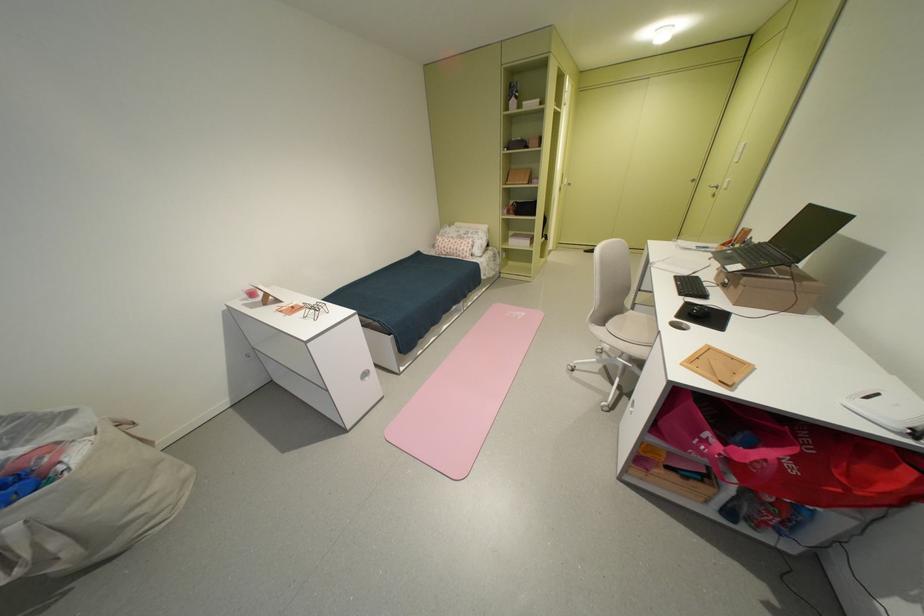
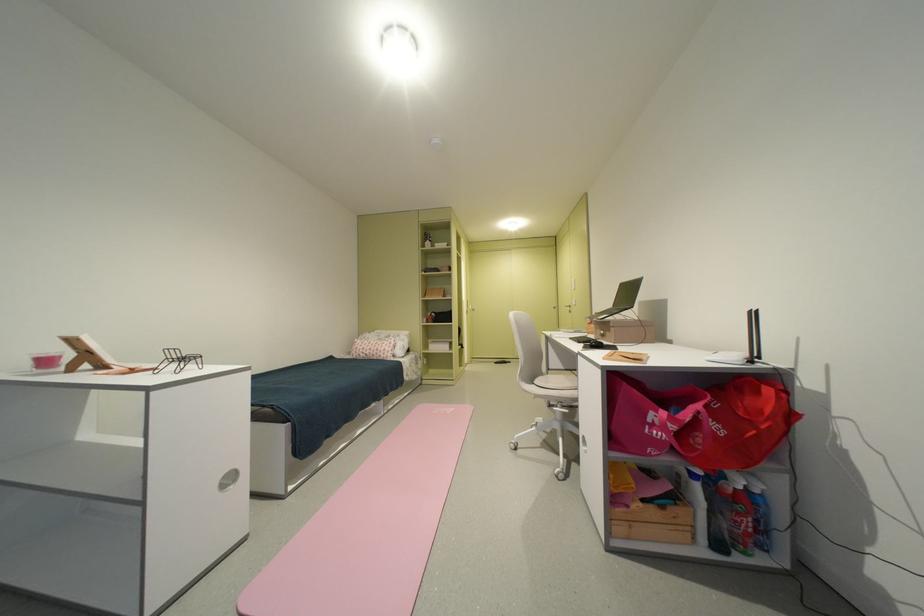
Where in the second image is the point corresponding to [658,471] from the first image?

(638, 508)